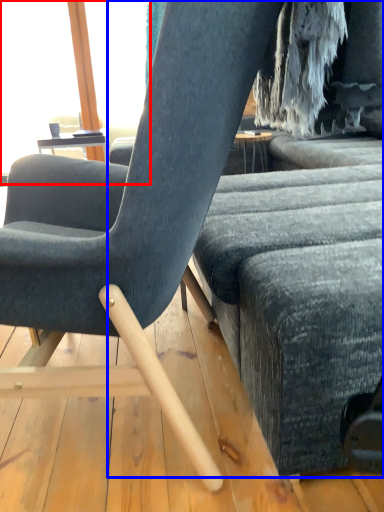
Question: Which of the following is the closest to the observer, window screen (highlighted by a red box) or studio couch (highlighted by a blue box)?

Choices:
 (A) window screen
 (B) studio couch

Answer: (B)